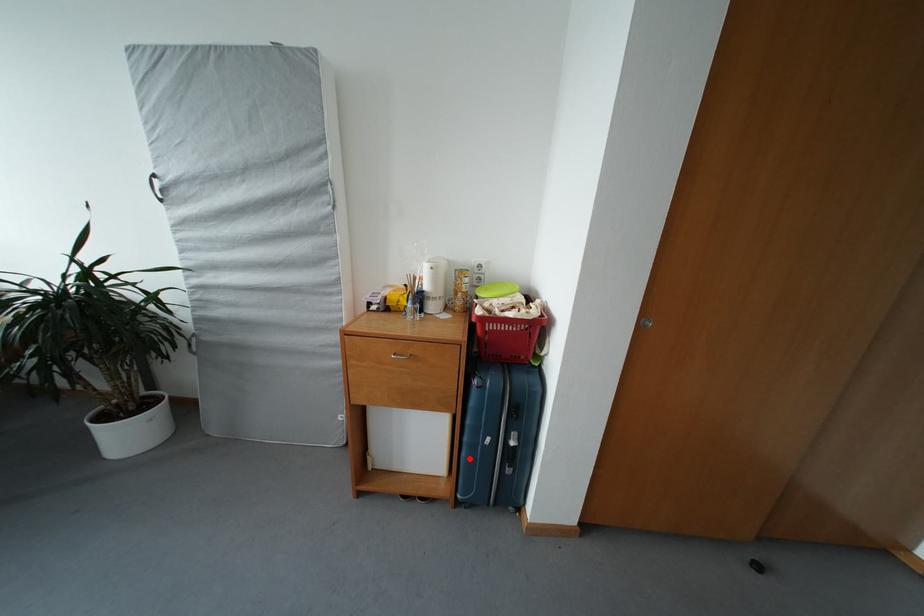
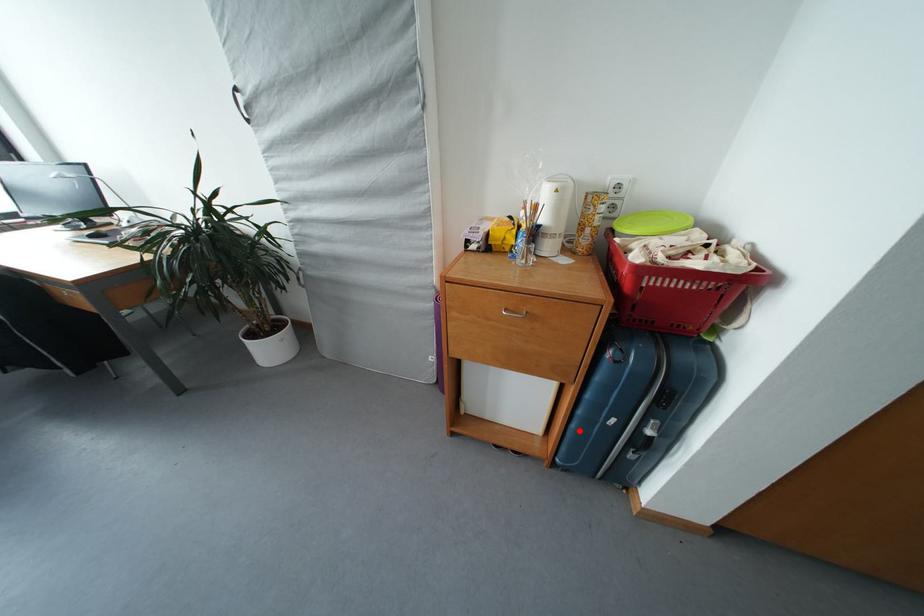
I am providing you with two images of the same scene from different viewpoints. A red point is marked on the first image and another point is marked on the second image. Do the highlighted points in image1 and image2 indicate the same real-world spot?

Yes